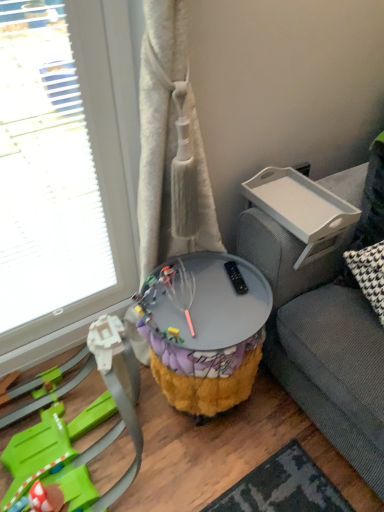
Describe the element at coordinates (302, 210) in the screenshot. The image size is (384, 512). I see `white plastic tray at upper right, the second table ordered from the bottom` at that location.

The image size is (384, 512). Describe the element at coordinates (204, 330) in the screenshot. I see `fuzzy fabric side table at center, acting as the 2th table starting from the top` at that location.

Locate an element on the screen. Image resolution: width=384 pixels, height=512 pixels. transparent glass door at left is located at coordinates (45, 172).

Can you confirm if fuzzy fabric side table at center, which is the first table from bottom to top, is thinner than white plastic tray at upper right, the second table ordered from the bottom?

No.

Considering the relative positions of fuzzy fabric side table at center, which is the first table from bottom to top, and white plastic tray at upper right, arranged as the first table when viewed from the top, in the image provided, is fuzzy fabric side table at center, which is the first table from bottom to top, to the left or to the right of white plastic tray at upper right, arranged as the first table when viewed from the top,?

In the image, fuzzy fabric side table at center, which is the first table from bottom to top, appears on the left side of white plastic tray at upper right, arranged as the first table when viewed from the top.

Is fuzzy fabric side table at center, which is the first table from bottom to top, inside the boundaries of white plastic tray at upper right, the second table ordered from the bottom, or outside?

fuzzy fabric side table at center, which is the first table from bottom to top, lies outside white plastic tray at upper right, the second table ordered from the bottom.

Is fuzzy fabric side table at center, acting as the 2th table starting from the top, positioned in front of white plastic tray at upper right, arranged as the first table when viewed from the top?

Yes, fuzzy fabric side table at center, acting as the 2th table starting from the top, is closer to the viewer.

Is plush yellow and purple toy at lower left spatially inside fuzzy fabric side table at center, acting as the 2th table starting from the top, or outside of it?

plush yellow and purple toy at lower left cannot be found inside fuzzy fabric side table at center, acting as the 2th table starting from the top.

Identify the location of toy on the left of fuzzy fabric side table at center, which is the first table from bottom to top. (68, 433).

Is plush yellow and purple toy at lower left wider or thinner than fuzzy fabric side table at center, acting as the 2th table starting from the top?

plush yellow and purple toy at lower left is wider than fuzzy fabric side table at center, acting as the 2th table starting from the top.

Is there a large distance between plush yellow and purple toy at lower left and fuzzy fabric side table at center, acting as the 2th table starting from the top?

No, there isn't a large distance between plush yellow and purple toy at lower left and fuzzy fabric side table at center, acting as the 2th table starting from the top.

From the image's perspective, is transparent glass door at left above plush yellow and purple toy at lower left?

Yes, from the image's perspective, transparent glass door at left is on top of plush yellow and purple toy at lower left.

Can you confirm if transparent glass door at left is positioned to the right of plush yellow and purple toy at lower left?

In fact, transparent glass door at left is to the left of plush yellow and purple toy at lower left.

Is point (97, 278) positioned after point (59, 419)?

Yes, it is.

From a real-world perspective, is white plastic tray at upper right, the second table ordered from the bottom, positioned above or below transparent glass door at left?

Clearly, from a real-world perspective, white plastic tray at upper right, the second table ordered from the bottom, is below transparent glass door at left.

Is point (308, 236) positioned in front of point (61, 106)?

Yes, it is.

Which is behind, white plastic tray at upper right, the second table ordered from the bottom, or transparent glass door at left?

white plastic tray at upper right, the second table ordered from the bottom, is further from the camera.

From the image's perspective, between plush yellow and purple toy at lower left and white plastic tray at upper right, the second table ordered from the bottom, who is located below?

plush yellow and purple toy at lower left appears lower in the image.

Is plush yellow and purple toy at lower left not near white plastic tray at upper right, the second table ordered from the bottom?

No, plush yellow and purple toy at lower left is not far from white plastic tray at upper right, the second table ordered from the bottom.

From the picture: Can you confirm if plush yellow and purple toy at lower left is thinner than white plastic tray at upper right, the second table ordered from the bottom?

No, plush yellow and purple toy at lower left is not thinner than white plastic tray at upper right, the second table ordered from the bottom.

Is plush yellow and purple toy at lower left aimed at white plastic tray at upper right, arranged as the first table when viewed from the top?

No, plush yellow and purple toy at lower left is not aimed at white plastic tray at upper right, arranged as the first table when viewed from the top.

This screenshot has width=384, height=512. Identify the location of glass door above the fuzzy fabric side table at center, which is the first table from bottom to top (from a real-world perspective). (45, 172).

Considering the sizes of fuzzy fabric side table at center, which is the first table from bottom to top, and transparent glass door at left in the image, is fuzzy fabric side table at center, which is the first table from bottom to top, taller or shorter than transparent glass door at left?

Clearly, fuzzy fabric side table at center, which is the first table from bottom to top, is shorter compared to transparent glass door at left.

From the image's perspective, would you say fuzzy fabric side table at center, acting as the 2th table starting from the top, is shown under transparent glass door at left?

Yes.

Is transparent glass door at left inside or outside of white plastic tray at upper right, the second table ordered from the bottom?

transparent glass door at left cannot be found inside white plastic tray at upper right, the second table ordered from the bottom.

From a real-world perspective, who is located higher, transparent glass door at left or white plastic tray at upper right, the second table ordered from the bottom?

transparent glass door at left, from a real-world perspective.

From the image's perspective, is transparent glass door at left over white plastic tray at upper right, arranged as the first table when viewed from the top?

Correct, transparent glass door at left appears higher than white plastic tray at upper right, arranged as the first table when viewed from the top, in the image.

Could you tell me if transparent glass door at left is turned towards white plastic tray at upper right, the second table ordered from the bottom?

No, transparent glass door at left is not oriented towards white plastic tray at upper right, the second table ordered from the bottom.

This screenshot has height=512, width=384. Find the location of `table on the right of fuzzy fabric side table at center, acting as the 2th table starting from the top`. table on the right of fuzzy fabric side table at center, acting as the 2th table starting from the top is located at coordinates (302, 210).

At what (x,y) coordinates should I click in order to perform the action: click on toy in front of the fuzzy fabric side table at center, which is the first table from bottom to top. Please return your answer as a coordinate pair (x, y). The height and width of the screenshot is (512, 384). Looking at the image, I should click on (68, 433).

Estimate the real-world distances between objects in this image. Which object is further from plush yellow and purple toy at lower left, fuzzy fabric side table at center, acting as the 2th table starting from the top, or transparent glass door at left?

transparent glass door at left is further to plush yellow and purple toy at lower left.

Consider the image. Considering their positions, is plush yellow and purple toy at lower left positioned closer to white plastic tray at upper right, arranged as the first table when viewed from the top, than fuzzy fabric side table at center, acting as the 2th table starting from the top?

The object closer to white plastic tray at upper right, arranged as the first table when viewed from the top, is fuzzy fabric side table at center, acting as the 2th table starting from the top.

Considering their positions, is white plastic tray at upper right, arranged as the first table when viewed from the top, positioned further to plush yellow and purple toy at lower left than transparent glass door at left?

Based on the image, white plastic tray at upper right, arranged as the first table when viewed from the top, appears to be further to plush yellow and purple toy at lower left.

From the image, which object appears to be farther from transparent glass door at left, fuzzy fabric side table at center, which is the first table from bottom to top, or white plastic tray at upper right, arranged as the first table when viewed from the top?

white plastic tray at upper right, arranged as the first table when viewed from the top.

Considering their positions, is transparent glass door at left positioned closer to fuzzy fabric side table at center, acting as the 2th table starting from the top, than plush yellow and purple toy at lower left?

plush yellow and purple toy at lower left lies closer to fuzzy fabric side table at center, acting as the 2th table starting from the top, than the other object.

Estimate the real-world distances between objects in this image. Which object is closer to fuzzy fabric side table at center, acting as the 2th table starting from the top, plush yellow and purple toy at lower left or transparent glass door at left?

plush yellow and purple toy at lower left.

Looking at the image, which one is located closer to transparent glass door at left, fuzzy fabric side table at center, acting as the 2th table starting from the top, or plush yellow and purple toy at lower left?

plush yellow and purple toy at lower left is closer to transparent glass door at left.

When comparing their distances from transparent glass door at left, does white plastic tray at upper right, the second table ordered from the bottom, or plush yellow and purple toy at lower left seem further?

white plastic tray at upper right, the second table ordered from the bottom.

Where is `toy located between transparent glass door at left and white plastic tray at upper right, arranged as the first table when viewed from the top, in the left-right direction`? The image size is (384, 512). toy located between transparent glass door at left and white plastic tray at upper right, arranged as the first table when viewed from the top, in the left-right direction is located at coordinates (68, 433).

The height and width of the screenshot is (512, 384). What are the coordinates of `table between transparent glass door at left and white plastic tray at upper right, the second table ordered from the bottom, from left to right` in the screenshot? It's located at (204, 330).

Image resolution: width=384 pixels, height=512 pixels. Identify the location of table between plush yellow and purple toy at lower left and white plastic tray at upper right, arranged as the first table when viewed from the top, from left to right. (204, 330).